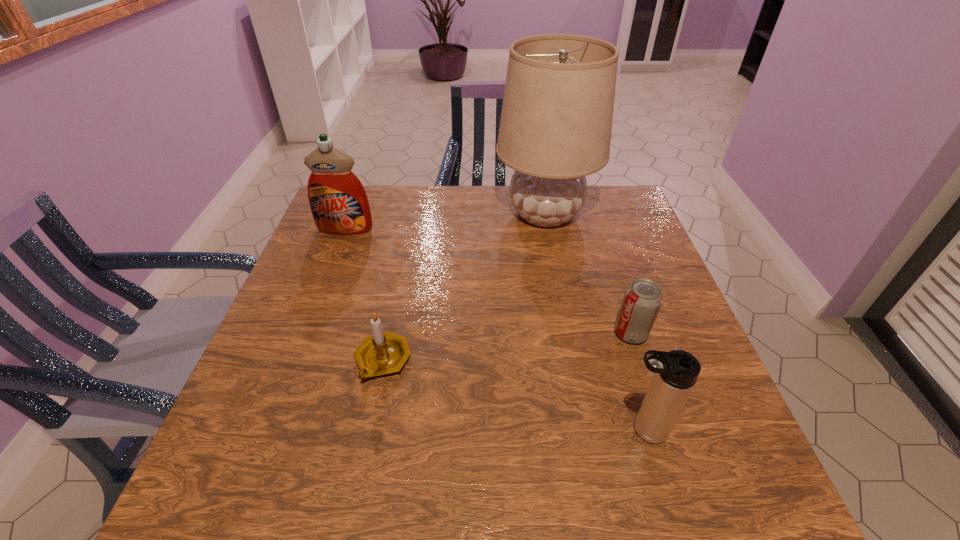
Where is `vacant space located on the handle side of the third shortest object`? Image resolution: width=960 pixels, height=540 pixels. vacant space located on the handle side of the third shortest object is located at coordinates (x=428, y=430).

Locate an element on the screen. free spot located 0.270m on the handle side of the third shortest object is located at coordinates (471, 430).

Where is `vacant point located on the back of the fourth object from right to left`? This screenshot has width=960, height=540. vacant point located on the back of the fourth object from right to left is located at coordinates (393, 313).

Where is `vacant space situated on the back of the soda can`? Image resolution: width=960 pixels, height=540 pixels. vacant space situated on the back of the soda can is located at coordinates (621, 302).

Identify the location of lampshade that is at the far edge. This screenshot has height=540, width=960. (556, 121).

Image resolution: width=960 pixels, height=540 pixels. Identify the location of detergent situated at the far edge. (339, 204).

In order to click on object that is at the left edge in this screenshot , I will do `click(339, 204)`.

The width and height of the screenshot is (960, 540). In order to click on lampshade at the right edge in this screenshot , I will do `click(556, 121)`.

This screenshot has width=960, height=540. What are the coordinates of `thermos bottle at the right edge` in the screenshot? It's located at (675, 373).

This screenshot has height=540, width=960. Identify the location of soda can that is at the right edge. (643, 297).